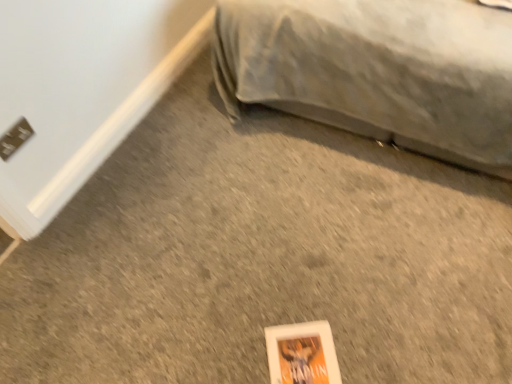
Question: From the image's perspective, is gray fabric bed at upper right beneath metallic gray electric outlet at lower left?

Choices:
 (A) yes
 (B) no

Answer: (B)

Question: Does gray fabric bed at upper right appear on the left side of metallic gray electric outlet at lower left?

Choices:
 (A) yes
 (B) no

Answer: (B)

Question: Is gray fabric bed at upper right oriented away from metallic gray electric outlet at lower left?

Choices:
 (A) yes
 (B) no

Answer: (B)

Question: Is metallic gray electric outlet at lower left completely or partially inside gray fabric bed at upper right?

Choices:
 (A) yes
 (B) no

Answer: (B)

Question: Is gray fabric bed at upper right touching metallic gray electric outlet at lower left?

Choices:
 (A) no
 (B) yes

Answer: (A)

Question: Is metallic gray electric outlet at lower left situated inside white matte paperback book at lower center or outside?

Choices:
 (A) inside
 (B) outside

Answer: (B)

Question: Looking at the image, does metallic gray electric outlet at lower left seem bigger or smaller compared to white matte paperback book at lower center?

Choices:
 (A) big
 (B) small

Answer: (B)

Question: From a real-world perspective, relative to white matte paperback book at lower center, is metallic gray electric outlet at lower left vertically above or below?

Choices:
 (A) above
 (B) below

Answer: (A)

Question: Relative to white matte paperback book at lower center, is metallic gray electric outlet at lower left in front or behind?

Choices:
 (A) front
 (B) behind

Answer: (B)

Question: Considering their positions, is gray fabric bed at upper right located in front of or behind white matte paperback book at lower center?

Choices:
 (A) behind
 (B) front

Answer: (B)

Question: Does point (437, 115) appear closer or farther from the camera than point (265, 327)?

Choices:
 (A) farther
 (B) closer

Answer: (A)

Question: In the image, is gray fabric bed at upper right on the left side or the right side of white matte paperback book at lower center?

Choices:
 (A) left
 (B) right

Answer: (B)

Question: Is gray fabric bed at upper right taller or shorter than white matte paperback book at lower center?

Choices:
 (A) tall
 (B) short

Answer: (A)

Question: In the image, is white matte paperback book at lower center positioned in front of or behind metallic gray electric outlet at lower left?

Choices:
 (A) behind
 (B) front

Answer: (B)

Question: Is point (282, 362) positioned closer to the camera than point (0, 152)?

Choices:
 (A) closer
 (B) farther

Answer: (A)